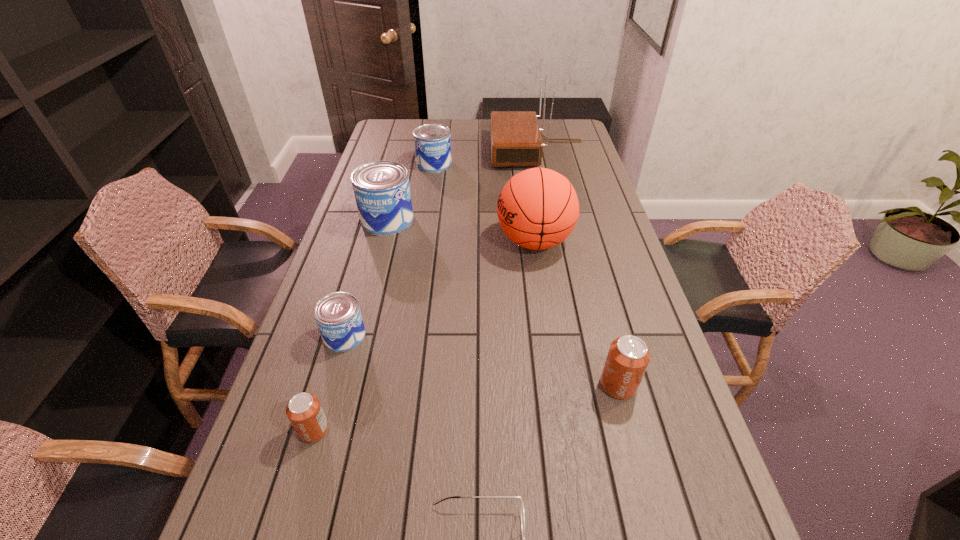
Find the location of a particular element. This screenshot has width=960, height=540. vacant space located 0.400m on the front label of the farthest blue can is located at coordinates (423, 235).

At what (x,y) coordinates should I click in order to perform the action: click on vacant space situated 0.160m on the back of the smaller orange can. Please return your answer as a coordinate pair (x, y). Image resolution: width=960 pixels, height=540 pixels. Looking at the image, I should click on (335, 357).

The width and height of the screenshot is (960, 540). Identify the location of free location located 0.260m on the front label of the third farthest can. (466, 336).

Locate an element on the screen. object situated at the far edge is located at coordinates (516, 140).

The height and width of the screenshot is (540, 960). Identify the location of radio_receiver positioned at the right edge. (516, 140).

Identify the location of basketball situated at the right edge. Image resolution: width=960 pixels, height=540 pixels. (538, 208).

This screenshot has height=540, width=960. In order to click on can that is positioned at the right edge in this screenshot , I will do `click(628, 357)`.

You are a GUI agent. You are given a task and a screenshot of the screen. Output one action in this format:
    pyautogui.click(x=<x>, y=<y>)
    Task: Click on the object located at the far right corner
    The width and height of the screenshot is (960, 540).
    Given the screenshot: What is the action you would take?
    pyautogui.click(x=516, y=140)

This screenshot has height=540, width=960. In order to click on free point at the far edge in this screenshot , I will do `click(540, 124)`.

I want to click on vacant space at the left edge, so click(x=330, y=454).